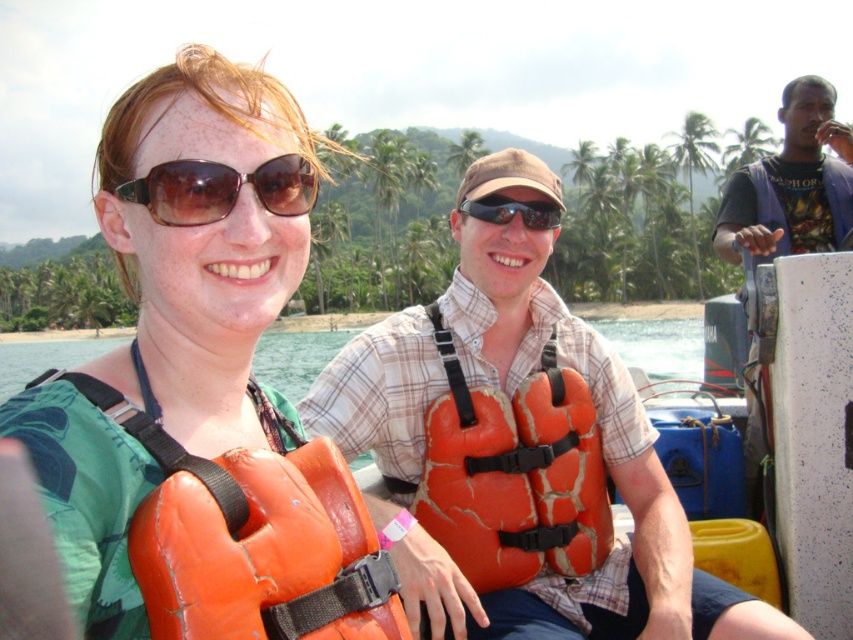
Question: Is orange rubber life vest at center thinner than orange matte life jacket at left?

Choices:
 (A) yes
 (B) no

Answer: (B)

Question: Estimate the real-world distances between objects in this image. Which object is farther from the brown reflective sunglasses at upper left?

Choices:
 (A) orange rubber life vest at center
 (B) orange matte life jacket at left
 (C) orange cracked life jacket at center

Answer: (C)

Question: Which point is closer to the camera?

Choices:
 (A) brown reflective sunglasses at upper left
 (B) sunglasses at center

Answer: (A)

Question: Does orange rubber life vest at center appear over orange cracked life jacket at center?

Choices:
 (A) yes
 (B) no

Answer: (A)

Question: Can you confirm if orange life vest at center is positioned below sunglasses at center?

Choices:
 (A) no
 (B) yes

Answer: (B)

Question: Which point is closer to the camera?

Choices:
 (A) dark blue fabric shirt at right
 (B) brown reflective sunglasses at upper left

Answer: (B)